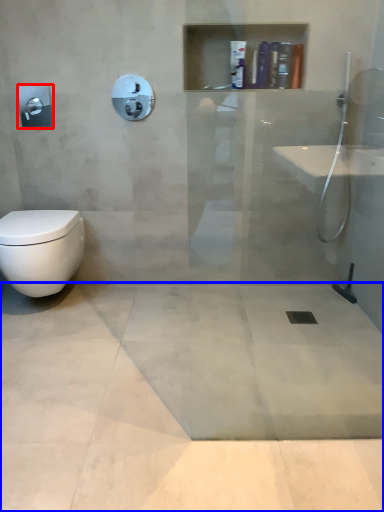
Question: Which point is closer to the camera, towel bar (highlighted by a red box) or concrete (highlighted by a blue box)?

Choices:
 (A) towel bar
 (B) concrete

Answer: (B)